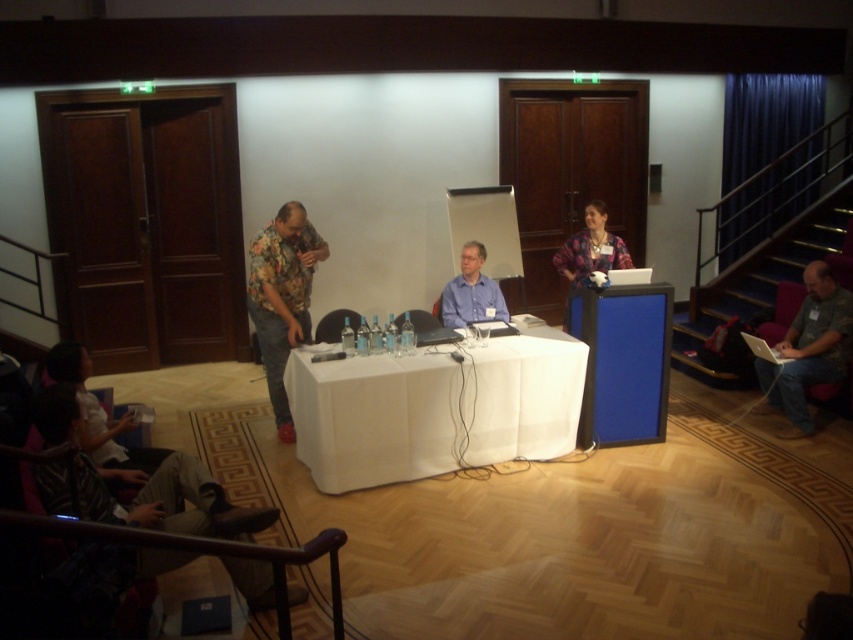
Does white fabric table at center appear on the left side of blue shirt at center?

Correct, you'll find white fabric table at center to the left of blue shirt at center.

Which is above, white fabric table at center or blue shirt at center?

blue shirt at center is higher up.

Find the location of a particular element. white fabric table at center is located at coordinates (434, 408).

Can you confirm if camouflage fabric shirt at lower right is positioned above blue shirt at center?

No, camouflage fabric shirt at lower right is not above blue shirt at center.

Does camouflage fabric shirt at lower right appear on the right side of blue shirt at center?

Yes, camouflage fabric shirt at lower right is to the right of blue shirt at center.

You are a GUI agent. You are given a task and a screenshot of the screen. Output one action in this format:
    pyautogui.click(x=<x>, y=<y>)
    Task: Click on the camouflage fabric shirt at lower right
    The height and width of the screenshot is (640, 853).
    Given the screenshot: What is the action you would take?
    pyautogui.click(x=808, y=349)

This screenshot has height=640, width=853. What are the coordinates of `camouflage fabric shirt at lower right` in the screenshot? It's located at (808, 349).

Is striped fabric shirt at lower left taller than patterned fabric shirt at center?

Correct, striped fabric shirt at lower left is much taller as patterned fabric shirt at center.

I want to click on striped fabric shirt at lower left, so click(169, 499).

Between point (260, 572) and point (598, 224), which one is positioned in front?

Positioned in front is point (260, 572).

Locate an element on the screen. Image resolution: width=853 pixels, height=640 pixels. striped fabric shirt at lower left is located at coordinates (169, 499).